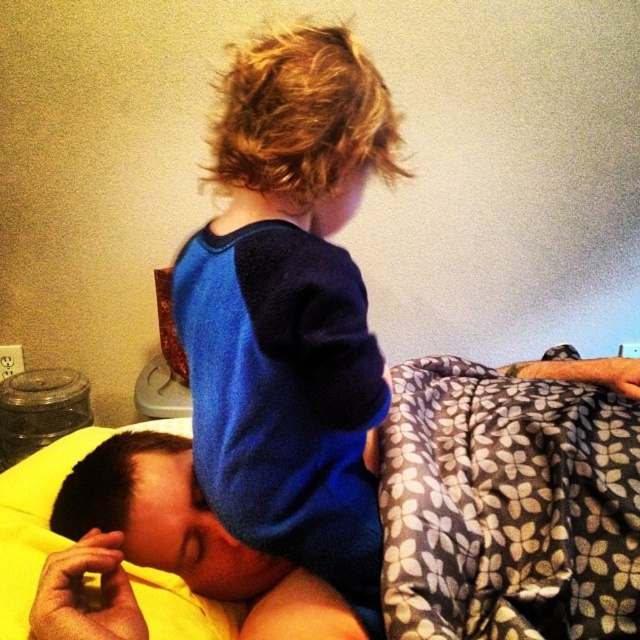
Question: Which point is farther to the camera?

Choices:
 (A) coord(616,580)
 (B) coord(307,410)

Answer: (A)

Question: Estimate the real-world distances between objects in this image. Which object is farther from the yellow soft pillow at lower left?

Choices:
 (A) blue soft fabric toddler at upper center
 (B) floral-patterned fabric at upper center
 (C) floral-patterned fleece blanket at upper right

Answer: (C)

Question: Does blue soft fabric toddler at upper center appear on the right side of yellow soft pillow at lower left?

Choices:
 (A) yes
 (B) no

Answer: (A)

Question: Does blue soft fabric toddler at upper center lie in front of yellow soft pillow at lower left?

Choices:
 (A) no
 (B) yes

Answer: (B)

Question: Which object is closer to the camera taking this photo?

Choices:
 (A) blue soft fabric toddler at upper center
 (B) yellow soft pillow at lower left
 (C) floral-patterned fleece blanket at upper right
 (D) floral-patterned fabric at upper center

Answer: (A)

Question: Does blue soft fabric toddler at upper center have a lesser width compared to floral-patterned fabric at upper center?

Choices:
 (A) no
 (B) yes

Answer: (B)